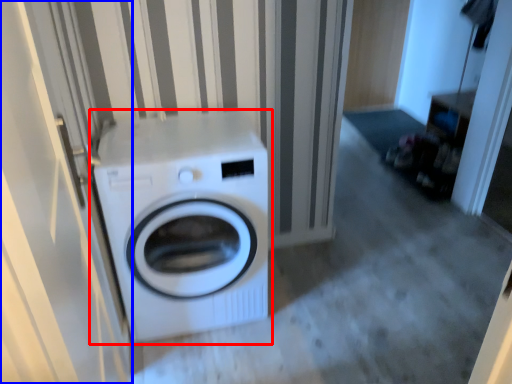
Question: Which point is further to the camera, washing machine (highlighted by a red box) or screen door (highlighted by a blue box)?

Choices:
 (A) washing machine
 (B) screen door

Answer: (A)